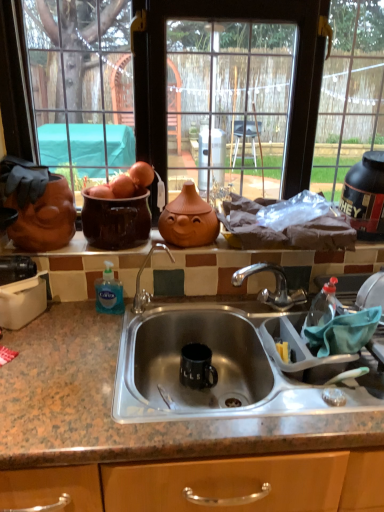
Question: Is matte glass window at upper center oriented towards blue translucent liquid soap at sink left?

Choices:
 (A) no
 (B) yes

Answer: (B)

Question: Is matte glass window at upper center wider than blue translucent liquid soap at sink left?

Choices:
 (A) yes
 (B) no

Answer: (A)

Question: Considering the relative sizes of matte glass window at upper center and blue translucent liquid soap at sink left in the image provided, is matte glass window at upper center shorter than blue translucent liquid soap at sink left?

Choices:
 (A) no
 (B) yes

Answer: (A)

Question: From a real-world perspective, is matte glass window at upper center under blue translucent liquid soap at sink left?

Choices:
 (A) yes
 (B) no

Answer: (B)

Question: Would you consider matte glass window at upper center to be distant from blue translucent liquid soap at sink left?

Choices:
 (A) yes
 (B) no

Answer: (B)

Question: Is matte glass window at upper center in front of or behind black rubber protein container at upper right in the image?

Choices:
 (A) front
 (B) behind

Answer: (A)

Question: In terms of width, does matte glass window at upper center look wider or thinner when compared to black rubber protein container at upper right?

Choices:
 (A) wide
 (B) thin

Answer: (A)

Question: From the image's perspective, is matte glass window at upper center above or below black rubber protein container at upper right?

Choices:
 (A) above
 (B) below

Answer: (A)

Question: Considering the positions of matte glass window at upper center and black rubber protein container at upper right in the image, is matte glass window at upper center taller or shorter than black rubber protein container at upper right?

Choices:
 (A) tall
 (B) short

Answer: (A)

Question: Is point (360, 160) positioned closer to the camera than point (125, 90)?

Choices:
 (A) farther
 (B) closer

Answer: (A)

Question: Visually, is black rubber protein container at upper right positioned to the left or to the right of matte glass window at upper center?

Choices:
 (A) left
 (B) right

Answer: (B)

Question: From a real-world perspective, is black rubber protein container at upper right positioned above or below matte glass window at upper center?

Choices:
 (A) below
 (B) above

Answer: (A)

Question: From the image's perspective, is black rubber protein container at upper right located above or below matte glass window at upper center?

Choices:
 (A) below
 (B) above

Answer: (A)

Question: From the image's perspective, is granite countertop at center located above or below matte glass window at upper center?

Choices:
 (A) above
 (B) below

Answer: (B)

Question: Considering their positions, is granite countertop at center located in front of or behind matte glass window at upper center?

Choices:
 (A) behind
 (B) front

Answer: (B)